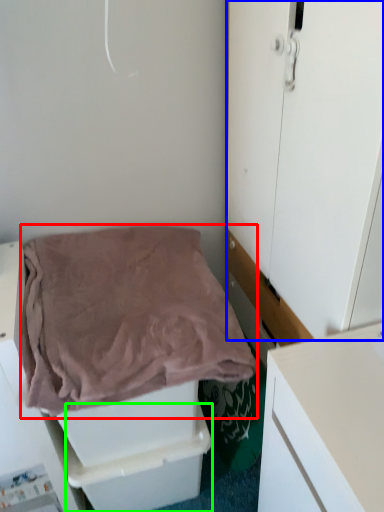
Question: Considering the real-world distances, which object is closest to blanket (highlighted by a red box)? door (highlighted by a blue box) or drawer (highlighted by a green box).

Choices:
 (A) door
 (B) drawer

Answer: (A)